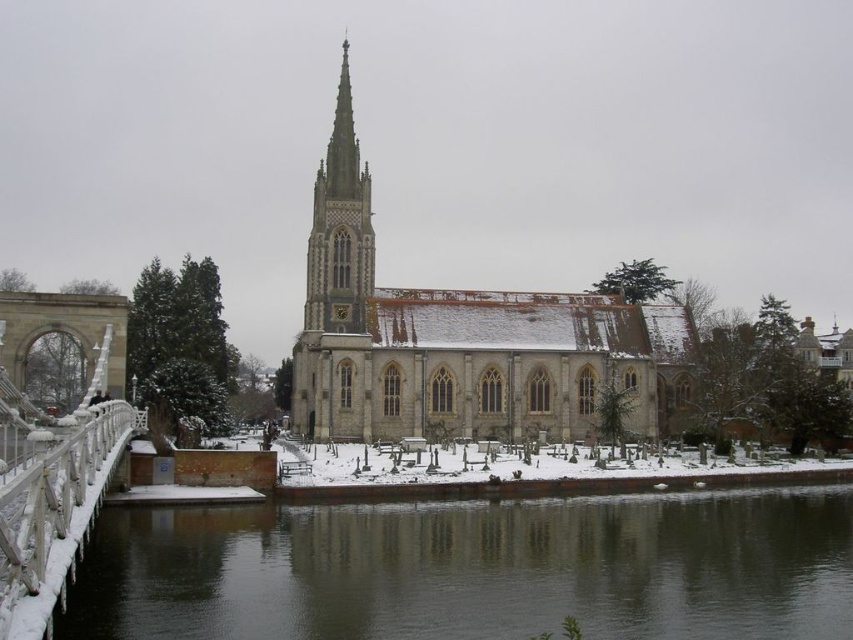
Can you confirm if stone church at center is taller than white stone spire at center?

Correct, stone church at center is much taller as white stone spire at center.

Does stone church at center have a lesser width compared to white stone spire at center?

No, stone church at center is not thinner than white stone spire at center.

Which is behind, point (537, 385) or point (345, 140)?

The point (345, 140) is more distant.

I want to click on stone church at center, so click(465, 340).

Who is more distant from viewer, (x=714, y=608) or (x=328, y=323)?

The point (x=328, y=323) is behind.

Is point (465, 588) behind point (328, 285)?

No.

Between point (693, 524) and point (315, 221), which one is positioned in front?

Point (693, 524)

You are a GUI agent. You are given a task and a screenshot of the screen. Output one action in this format:
    pyautogui.click(x=<x>, y=<y>)
    Task: Click on the black ice at lower left
    The image size is (853, 640).
    Given the screenshot: What is the action you would take?
    pyautogui.click(x=474, y=570)

Is stone church at center below white frosted bridge at left?

Incorrect, stone church at center is not positioned below white frosted bridge at left.

Is stone church at center above white frosted bridge at left?

Correct, stone church at center is located above white frosted bridge at left.

What do you see at coordinates (465, 340) in the screenshot?
I see `stone church at center` at bounding box center [465, 340].

You are a GUI agent. You are given a task and a screenshot of the screen. Output one action in this format:
    pyautogui.click(x=<x>, y=<y>)
    Task: Click on the stone church at center
    
    Given the screenshot: What is the action you would take?
    pyautogui.click(x=465, y=340)